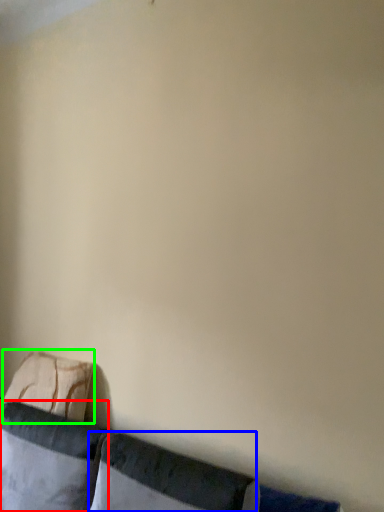
Question: Based on their relative distances, which object is farther from pillow (highlighted by a red box)? Choose from pillow (highlighted by a blue box) and pillow (highlighted by a green box).

Choices:
 (A) pillow
 (B) pillow

Answer: (A)